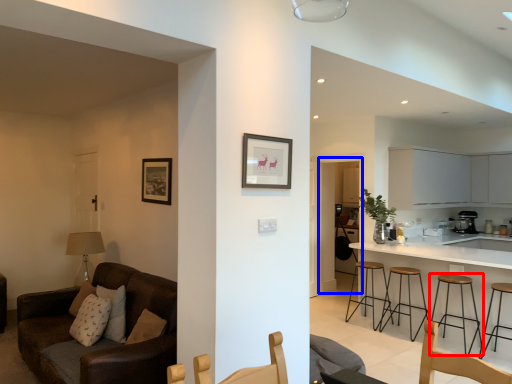
Question: Which object appears closest to the camera in this image, stool (highlighted by a red box) or glass door (highlighted by a blue box)?

Choices:
 (A) stool
 (B) glass door

Answer: (A)